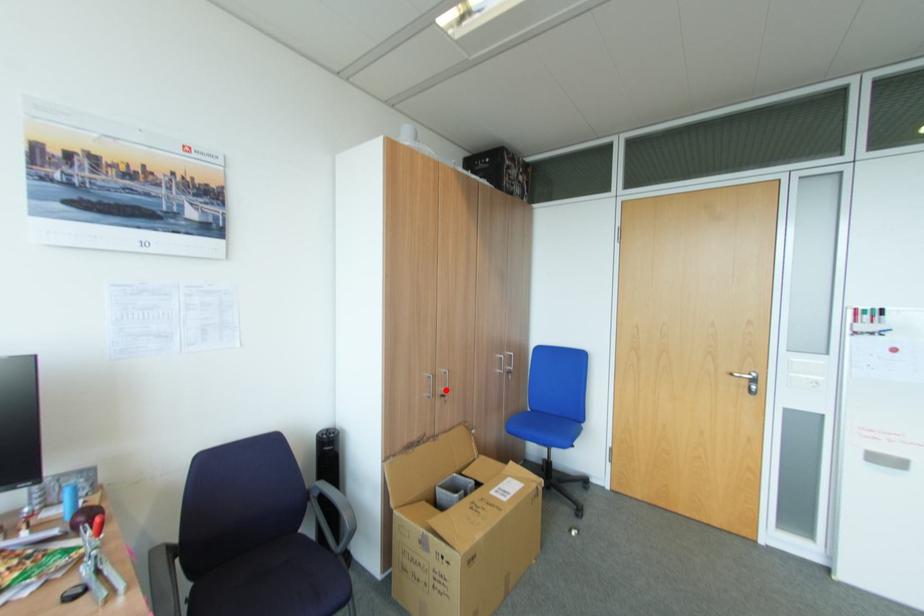
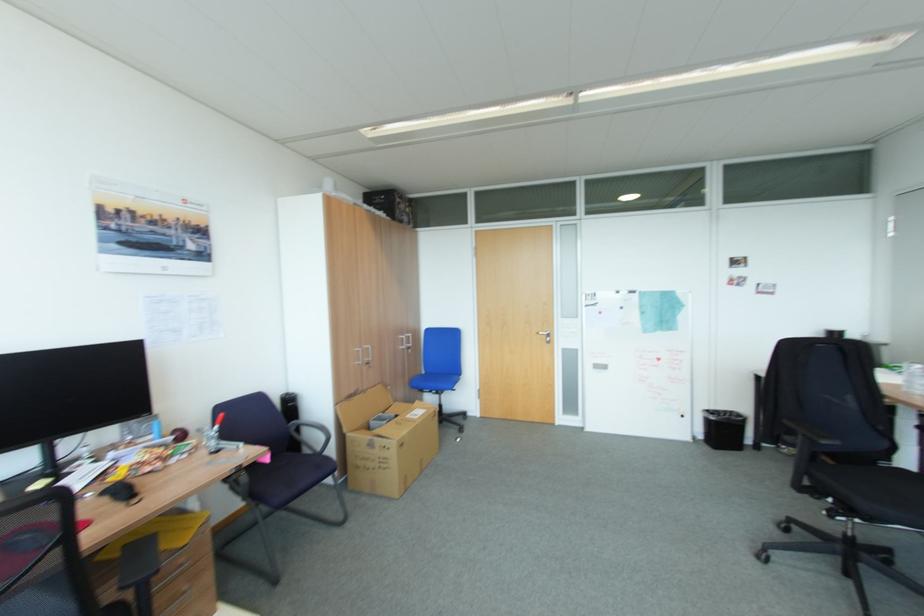
Question: I am providing you with two images of the same scene from different viewpoints. A red point is shown in image1. For the corresponding object point in image2, is it positioned nearer or farther from the camera?

Choices:
 (A) Nearer
 (B) Farther

Answer: (A)